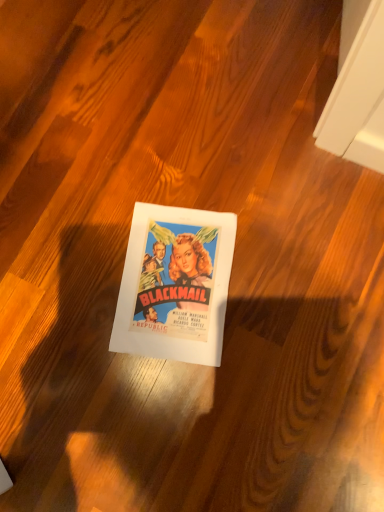
The width and height of the screenshot is (384, 512). Find the location of `vacant region to the left of white paper poster at center`. vacant region to the left of white paper poster at center is located at coordinates [62, 310].